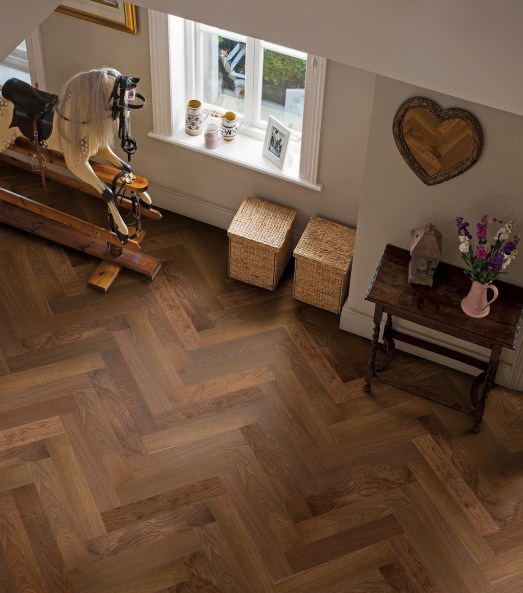
Where is `baseboard`? The width and height of the screenshot is (523, 593). baseboard is located at coordinates (202, 213).